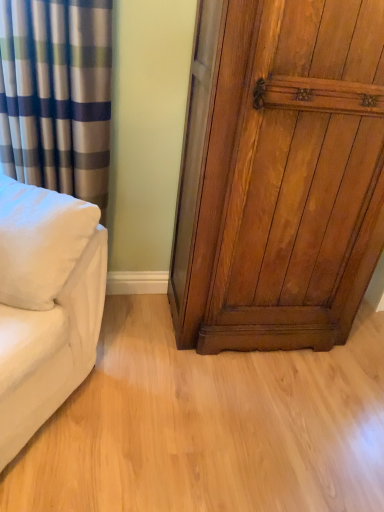
What do you see at coordinates (283, 178) in the screenshot? Image resolution: width=384 pixels, height=512 pixels. I see `shiny brown wood door at right` at bounding box center [283, 178].

Where is `white soft pillow at left`? Image resolution: width=384 pixels, height=512 pixels. white soft pillow at left is located at coordinates (39, 242).

Describe the element at coordinates (57, 95) in the screenshot. I see `silky blue-green striped curtain at left` at that location.

You are a GUI agent. You are given a task and a screenshot of the screen. Output one action in this format:
    pyautogui.click(x=<x>, y=<y>)
    Task: Click on the shiny brown wood door at right
    The height and width of the screenshot is (512, 384).
    Given the screenshot: What is the action you would take?
    pyautogui.click(x=283, y=178)

The image size is (384, 512). In order to click on curtain above the shiny brown wood door at right (from the image's perspective) in this screenshot , I will do `click(57, 95)`.

Which point is more distant from viewer, (300, 137) or (89, 23)?

Positioned behind is point (300, 137).

Would you say silky blue-green striped curtain at left is part of shiny brown wood door at right's contents?

That's incorrect, silky blue-green striped curtain at left is not inside shiny brown wood door at right.

Is light wood floor at center facing away from shiny brown wood door at right?

light wood floor at center is not turned away from shiny brown wood door at right.

Is light wood floor at center surrounding shiny brown wood door at right?

No.

From a real-world perspective, is light wood floor at center positioned above or below shiny brown wood door at right?

light wood floor at center is situated lower than shiny brown wood door at right in the real world.

Considering their positions, is light wood floor at center located in front of or behind shiny brown wood door at right?

Visually, light wood floor at center is located behind shiny brown wood door at right.

From the image's perspective, is white soft pillow at left on light wood floor at center?

Yes.

Is point (22, 243) more distant than point (162, 316)?

That is False.

Is white soft pillow at left wider than light wood floor at center?

In fact, white soft pillow at left might be narrower than light wood floor at center.

Can you confirm if light wood floor at center is taller than white soft pillow at left?

No, light wood floor at center is not taller than white soft pillow at left.

Locate an element on the screen. The width and height of the screenshot is (384, 512). plain on the right of the white soft pillow at left is located at coordinates (209, 425).

Does light wood floor at center have a larger size compared to white soft pillow at left?

Correct, light wood floor at center is larger in size than white soft pillow at left.

In the scene shown: From the image's perspective, between light wood floor at center and white soft pillow at left, who is located below?

light wood floor at center, from the image's perspective.

Is white soft pillow at left inside the boundaries of shiny brown wood door at right, or outside?

white soft pillow at left is spatially situated outside shiny brown wood door at right.

Is white soft pillow at left positioned with its back to shiny brown wood door at right?

That's not correct — white soft pillow at left is not looking away from shiny brown wood door at right.

Which point is more distant from viewer, (62, 280) or (349, 288)?

The point (349, 288) is more distant.

From the image's perspective, which one is positioned lower, white soft pillow at left or shiny brown wood door at right?

white soft pillow at left appears lower in the image.

Is silky blue-green striped curtain at left placed right next to white soft pillow at left?

No, silky blue-green striped curtain at left is not touching white soft pillow at left.

What's the angular difference between silky blue-green striped curtain at left and white soft pillow at left's facing directions?

There is a 34.5-degree angle between the facing directions of silky blue-green striped curtain at left and white soft pillow at left.

Considering the points (21, 126) and (36, 189), which point is behind, point (21, 126) or point (36, 189)?

The point (21, 126) is farther from the camera.

From the image's perspective, which object appears higher, silky blue-green striped curtain at left or white soft pillow at left?

From the image's view, silky blue-green striped curtain at left is above.

How different are the orientations of light wood floor at center and silky blue-green striped curtain at left in degrees?

The angular difference between light wood floor at center and silky blue-green striped curtain at left is 91.9 degrees.

This screenshot has width=384, height=512. In order to click on plain on the right side of silky blue-green striped curtain at left in this screenshot , I will do `click(209, 425)`.

Is light wood floor at center turned away from silky blue-green striped curtain at left?

light wood floor at center is not turned away from silky blue-green striped curtain at left.

Which is behind, light wood floor at center or silky blue-green striped curtain at left?

silky blue-green striped curtain at left is behind.

Find the location of a particular element. door above the silky blue-green striped curtain at left (from a real-world perspective) is located at coordinates (283, 178).

This screenshot has width=384, height=512. I want to click on door lying above the light wood floor at center (from the image's perspective), so click(283, 178).

Estimate the real-world distances between objects in this image. Which object is further from white soft pillow at left, light wood floor at center or silky blue-green striped curtain at left?

Based on the image, light wood floor at center appears to be further to white soft pillow at left.

Which object lies nearer to the anchor point silky blue-green striped curtain at left, white soft pillow at left or light wood floor at center?

Among the two, white soft pillow at left is located nearer to silky blue-green striped curtain at left.

Based on their spatial positions, is shiny brown wood door at right or silky blue-green striped curtain at left closer to white soft pillow at left?

silky blue-green striped curtain at left lies closer to white soft pillow at left than the other object.

Which object lies nearer to the anchor point light wood floor at center, silky blue-green striped curtain at left or white soft pillow at left?

white soft pillow at left is closer to light wood floor at center.

When comparing their distances from light wood floor at center, does white soft pillow at left or silky blue-green striped curtain at left seem further?

Based on the image, silky blue-green striped curtain at left appears to be further to light wood floor at center.

Based on the photo, from the image, which object appears to be nearer to white soft pillow at left, light wood floor at center or shiny brown wood door at right?

shiny brown wood door at right is closer to white soft pillow at left.

When comparing their distances from silky blue-green striped curtain at left, does shiny brown wood door at right or white soft pillow at left seem closer?

white soft pillow at left is closer to silky blue-green striped curtain at left.

Which object lies further to the anchor point silky blue-green striped curtain at left, light wood floor at center or white soft pillow at left?

light wood floor at center.

Find the location of a particular element. The height and width of the screenshot is (512, 384). curtain between white soft pillow at left and shiny brown wood door at right in the horizontal direction is located at coordinates (57, 95).

I want to click on plain between white soft pillow at left and shiny brown wood door at right, so click(209, 425).

The width and height of the screenshot is (384, 512). Find the location of `curtain between white soft pillow at left and light wood floor at center in the horizontal direction`. curtain between white soft pillow at left and light wood floor at center in the horizontal direction is located at coordinates (57, 95).

Locate an element on the screen. plain between silky blue-green striped curtain at left and shiny brown wood door at right in the horizontal direction is located at coordinates (209, 425).